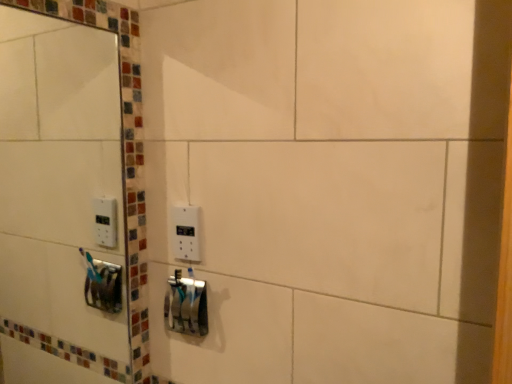
Question: Is white plastic light switch at center placed right next to white glossy mirror at upper left?

Choices:
 (A) yes
 (B) no

Answer: (B)

Question: Is white plastic light switch at center far from white glossy mirror at upper left?

Choices:
 (A) yes
 (B) no

Answer: (B)

Question: Is white plastic light switch at center wider than white glossy mirror at upper left?

Choices:
 (A) yes
 (B) no

Answer: (B)

Question: Is white glossy mirror at upper left located within white plastic light switch at center?

Choices:
 (A) yes
 (B) no

Answer: (B)

Question: Is white plastic light switch at center to the left of white glossy mirror at upper left from the viewer's perspective?

Choices:
 (A) yes
 (B) no

Answer: (B)

Question: Visually, is metallic silver toothbrush holder at center positioned to the left or to the right of white plastic light switch at center?

Choices:
 (A) left
 (B) right

Answer: (A)

Question: Considering their positions, is metallic silver toothbrush holder at center located in front of or behind white plastic light switch at center?

Choices:
 (A) front
 (B) behind

Answer: (A)

Question: From the image's perspective, is metallic silver toothbrush holder at center positioned above or below white plastic light switch at center?

Choices:
 (A) below
 (B) above

Answer: (A)

Question: Is metallic silver toothbrush holder at center bigger or smaller than white plastic light switch at center?

Choices:
 (A) big
 (B) small

Answer: (A)

Question: From a real-world perspective, is white glossy mirror at upper left physically located above or below metallic silver toothbrush holder at center?

Choices:
 (A) below
 (B) above

Answer: (B)

Question: Considering the positions of point (93, 311) and point (195, 297), is point (93, 311) closer or farther from the camera than point (195, 297)?

Choices:
 (A) farther
 (B) closer

Answer: (A)

Question: Is white glossy mirror at upper left taller or shorter than metallic silver toothbrush holder at center?

Choices:
 (A) tall
 (B) short

Answer: (A)

Question: Considering the positions of white glossy mirror at upper left and metallic silver toothbrush holder at center in the image, is white glossy mirror at upper left bigger or smaller than metallic silver toothbrush holder at center?

Choices:
 (A) small
 (B) big

Answer: (B)

Question: From the image's perspective, relative to white glossy mirror at upper left, is white plastic light switch at center above or below?

Choices:
 (A) below
 (B) above

Answer: (A)

Question: Considering the positions of point (185, 251) and point (89, 211), is point (185, 251) closer or farther from the camera than point (89, 211)?

Choices:
 (A) farther
 (B) closer

Answer: (B)